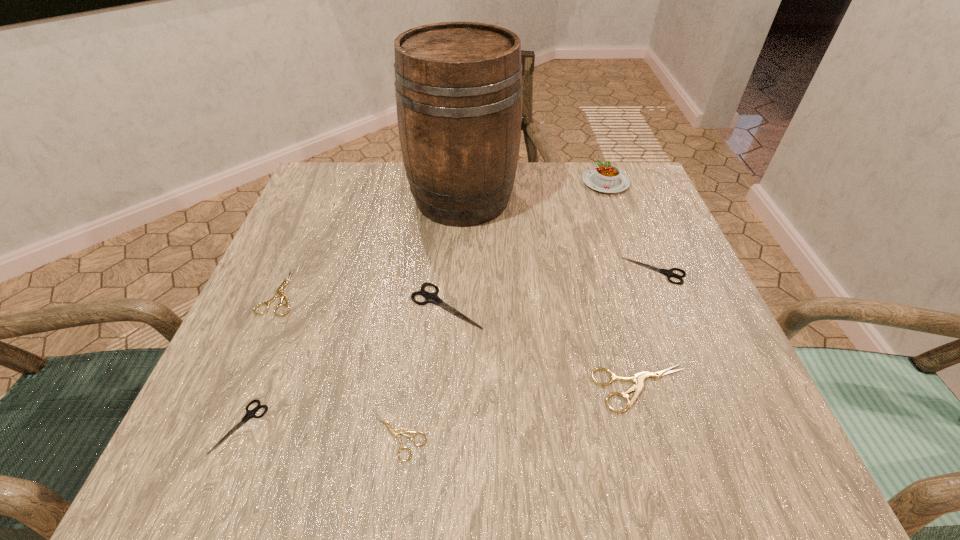
At what (x,y) coordinates should I click in order to perform the action: click on beige shears that is the third closest one to the second biggest black shears. Please return your answer as a coordinate pair (x, y). The height and width of the screenshot is (540, 960). Looking at the image, I should click on (279, 291).

Where is `vacant space that satisfies the following two spatial constraints: 1. on the side of the rightmost beige shears near the bung hole; 2. on the left side of the cider`? vacant space that satisfies the following two spatial constraints: 1. on the side of the rightmost beige shears near the bung hole; 2. on the left side of the cider is located at coordinates (454, 388).

The width and height of the screenshot is (960, 540). Identify the location of vacant space that satisfies the following two spatial constraints: 1. on the back side of the nearest black shears; 2. on the right side of the second biggest black shears. (303, 271).

The width and height of the screenshot is (960, 540). I want to click on vacant space that satisfies the following two spatial constraints: 1. on the side of the second biggest black shears near the bung hole; 2. on the right side of the tallest object, so click(x=460, y=271).